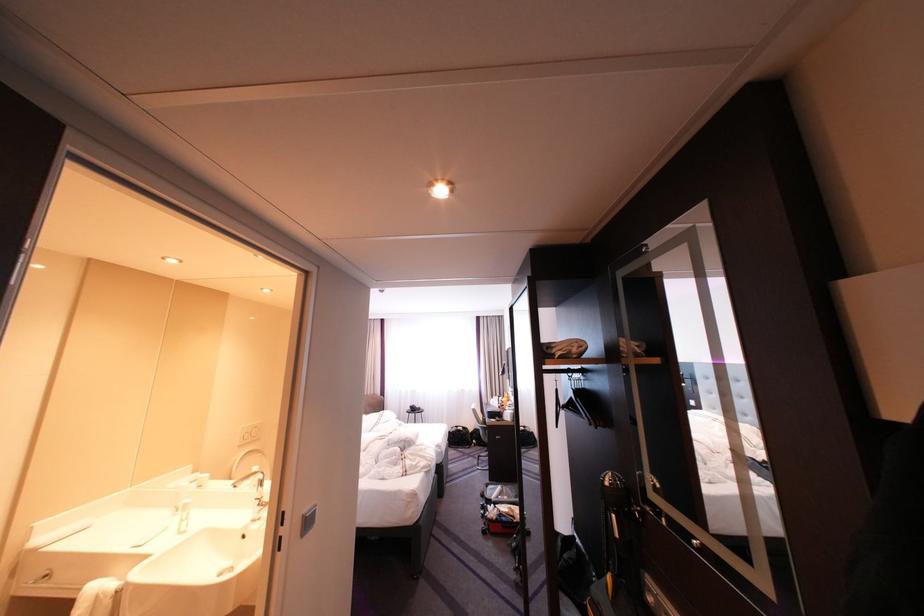
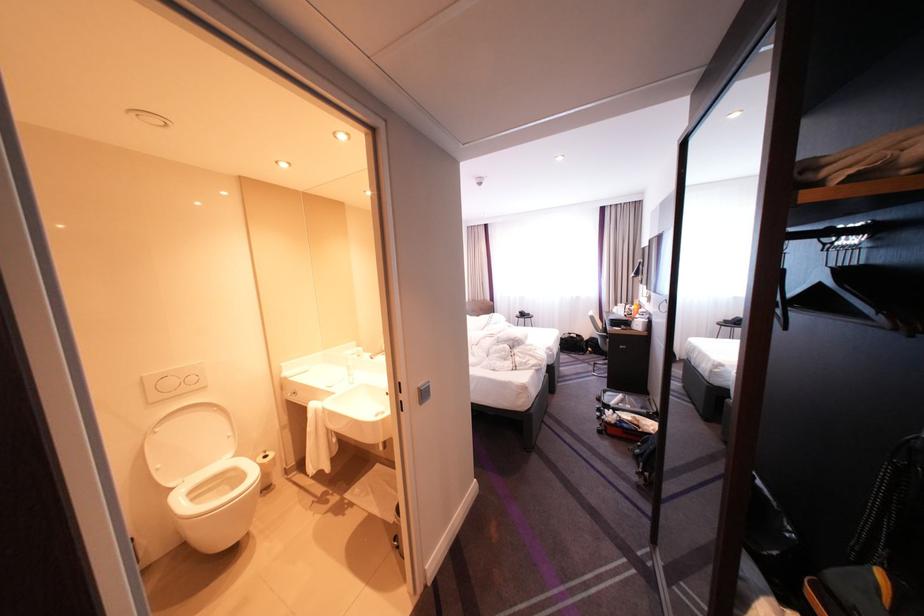
The point at (x=314, y=516) is marked in the first image. Where is the corresponding point in the second image?

(430, 389)